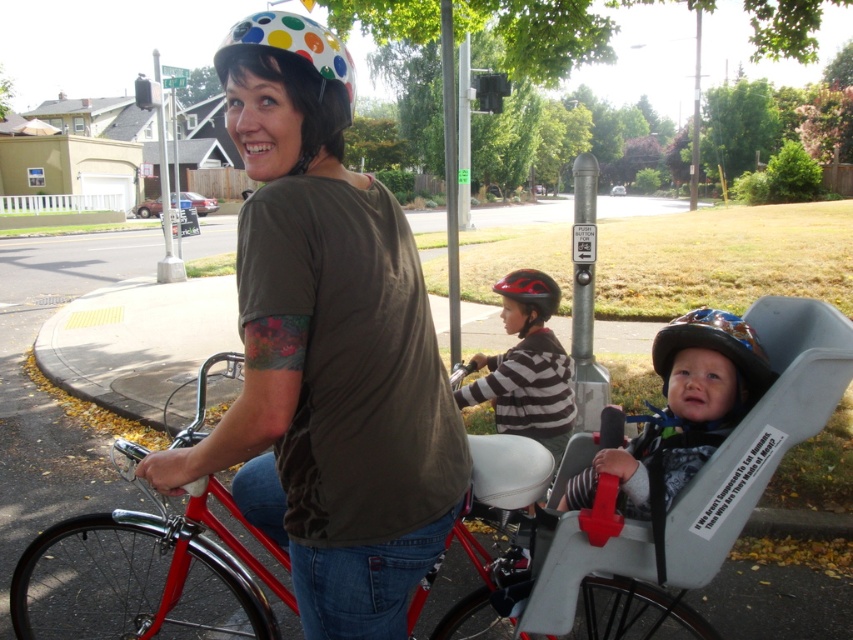
Question: Among these objects, which one is farthest from the camera?

Choices:
 (A) matte black helmet at upper center
 (B) striped cotton shirt at center
 (C) shiny blue helmet at center
 (D) matte black helmet at center

Answer: (B)

Question: Does striped cotton shirt at center appear under white polka dot helmet at upper center?

Choices:
 (A) no
 (B) yes

Answer: (B)

Question: Is matte black helmet at center closer to the viewer compared to white polka dot helmet at upper center?

Choices:
 (A) no
 (B) yes

Answer: (A)

Question: Which point is closer to the camera taking this photo?

Choices:
 (A) (496, 403)
 (B) (459, 332)

Answer: (A)

Question: Is striped cotton shirt at center further to the viewer compared to white polka dot helmet at upper center?

Choices:
 (A) yes
 (B) no

Answer: (A)

Question: Which of the following is the farthest from the observer?

Choices:
 (A) (181, 536)
 (B) (749, 358)
 (C) (538, 442)
 (D) (374, 328)

Answer: (C)